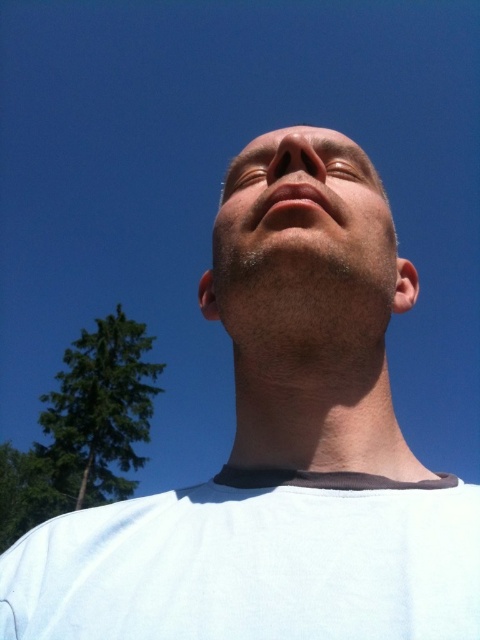
You are a photographer adjusting the focus on your camera. You need to ensure that both the smooth skin head at center and the brown matte eye at upper center are in focus. Given their sizes, which object should you prioritize focusing on first?

The smooth skin head at center has a larger size compared to the brown matte eye at upper center, so you should prioritize focusing on the smooth skin head at center first as it occupies more of the frame and requires precise focus to capture details.

You are a photographer adjusting your camera to focus on the two points in the image. The first point is at coordinates point (435, 636) and the second is at point (320, 163). Which point should you focus on first if you want to capture the foreground clearly?

Point (435, 636) is in front of point (320, 163), so you should focus on point (435, 636) first to capture the foreground clearly.